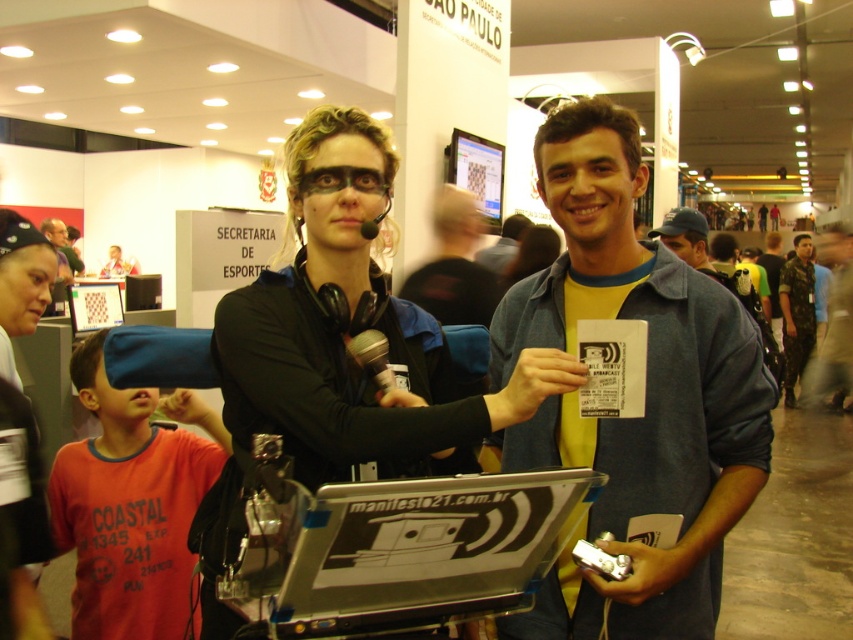
You are a photographer at the event and want to capture a photo of both the denim jacket at center and the blue denim shirt at center. Which clothing item is positioned higher in the frame?

The denim jacket at center is located above the blue denim shirt at center, so it is positioned higher in the frame.